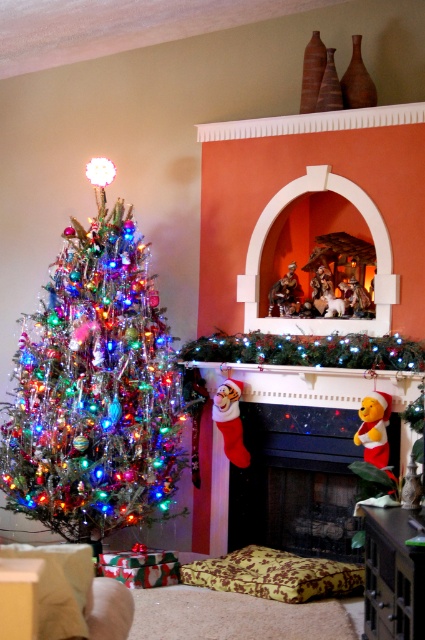
Question: Where is shiny metallic tree at left located in relation to velvet winnie the pooh at lower right in the image?

Choices:
 (A) above
 (B) below

Answer: (A)

Question: Where is shiny metallic tree at left located in relation to velvet winnie the pooh at lower right in the image?

Choices:
 (A) right
 (B) left

Answer: (B)

Question: Which point is closer to the camera?

Choices:
 (A) (314, 524)
 (B) (135, 371)

Answer: (B)

Question: Which of the following is the farthest from the observer?

Choices:
 (A) (28, 484)
 (B) (252, 492)

Answer: (B)

Question: Considering the relative positions of shiny metallic tree at left and velvet winnie the pooh at lower right in the image provided, where is shiny metallic tree at left located with respect to velvet winnie the pooh at lower right?

Choices:
 (A) left
 (B) right

Answer: (A)

Question: Among these objects, which one is nearest to the camera?

Choices:
 (A) velvet winnie the pooh at lower right
 (B) shiny metallic tree at left

Answer: (B)